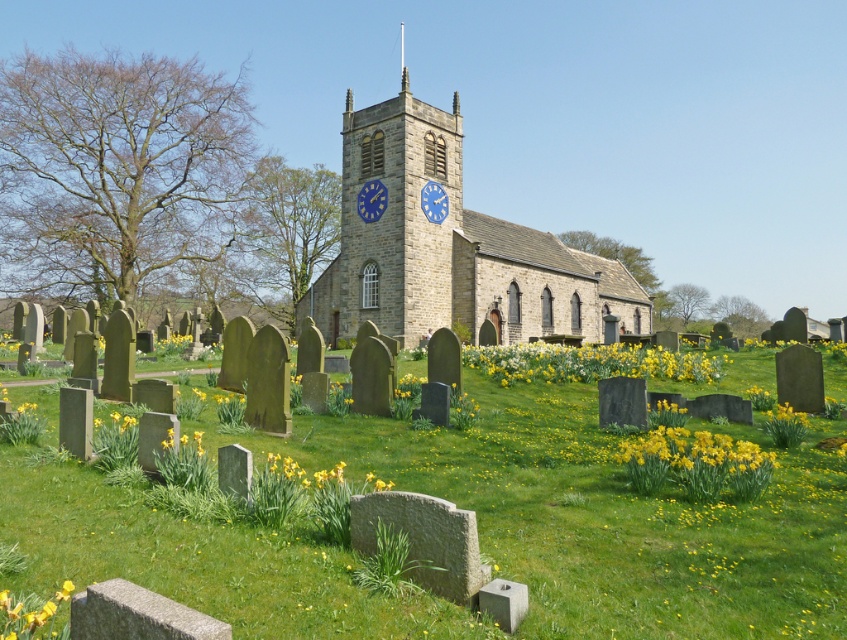
Question: Considering the relative positions of stone church at center and yellow matte flower at lower left in the image provided, where is stone church at center located with respect to yellow matte flower at lower left?

Choices:
 (A) left
 (B) right

Answer: (B)

Question: Among these objects, which one is farthest from the camera?

Choices:
 (A) yellow matte flower at lower left
 (B) yellow matte flowers at center
 (C) stone church at center
 (D) smooth stone tombstones at center

Answer: (C)

Question: Does smooth stone tombstones at center have a smaller size compared to yellow matte flower at lower left?

Choices:
 (A) yes
 (B) no

Answer: (B)

Question: Which of the following is the farthest from the observer?

Choices:
 (A) stone church at center
 (B) smooth stone tombstones at center

Answer: (A)

Question: Based on their relative distances, which object is nearer to the yellow matte flowers at center?

Choices:
 (A) stone church at center
 (B) smooth stone tombstones at center
 (C) yellow matte flower at lower left

Answer: (B)

Question: Observing the image, what is the correct spatial positioning of stone church at center in reference to yellow matte flower at lower left?

Choices:
 (A) left
 (B) right

Answer: (B)